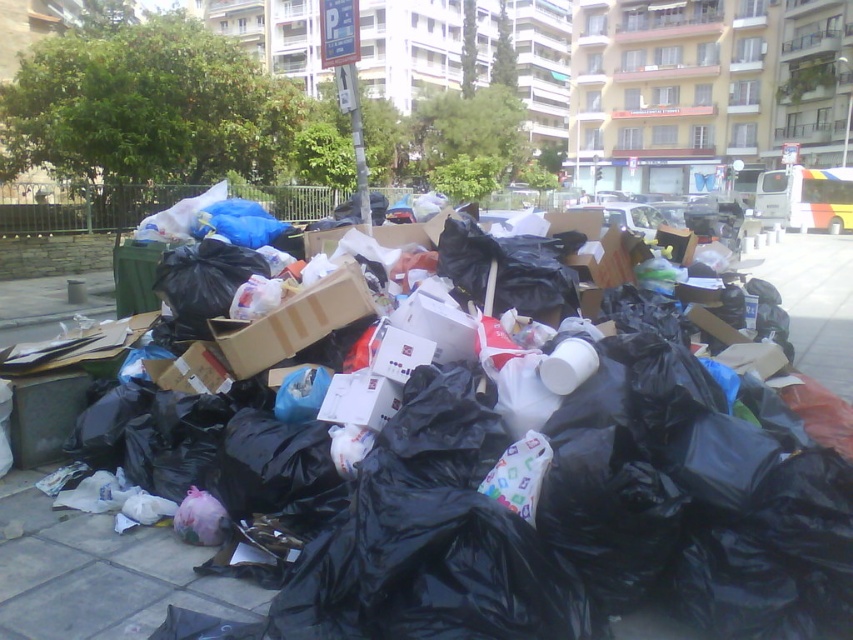
In the scene shown: Which of these two, black plastic bags at center or brown cardboard box at center, stands shorter?

With less height is brown cardboard box at center.

Is black plastic bags at center shorter than brown cardboard box at center?

No, black plastic bags at center is not shorter than brown cardboard box at center.

Find the location of a particular element. black plastic bags at center is located at coordinates (817, 301).